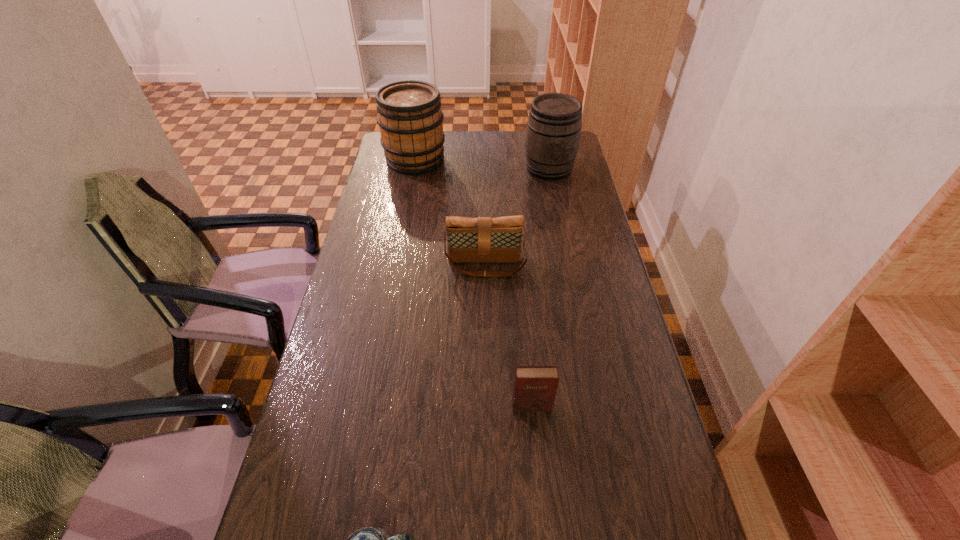
Image resolution: width=960 pixels, height=540 pixels. I want to click on cider, so click(x=411, y=122).

At what (x,y) coordinates should I click in order to perform the action: click on the rightmost object. Please return your answer as a coordinate pair (x, y). This screenshot has width=960, height=540. Looking at the image, I should click on (553, 132).

You are a GUI agent. You are given a task and a screenshot of the screen. Output one action in this format:
    pyautogui.click(x=<x>, y=<y>)
    Task: Click on the shoulder bag
    The width and height of the screenshot is (960, 540).
    Given the screenshot: What is the action you would take?
    pyautogui.click(x=482, y=239)

This screenshot has height=540, width=960. I want to click on the third shortest object, so click(482, 239).

This screenshot has width=960, height=540. I want to click on the fourth farthest object, so click(x=534, y=389).

The image size is (960, 540). Identify the location of diary. (534, 389).

Locate an element on the screen. vacant space located on the right of the cider is located at coordinates (474, 159).

Where is `free space located on the left of the rightmost object`? free space located on the left of the rightmost object is located at coordinates (491, 168).

Identify the location of free location located 0.220m on the front-facing side of the shoulder bag. The image size is (960, 540). (487, 333).

The image size is (960, 540). Identify the location of vacant point located 0.050m on the front cover of the second nearest object. click(x=534, y=431).